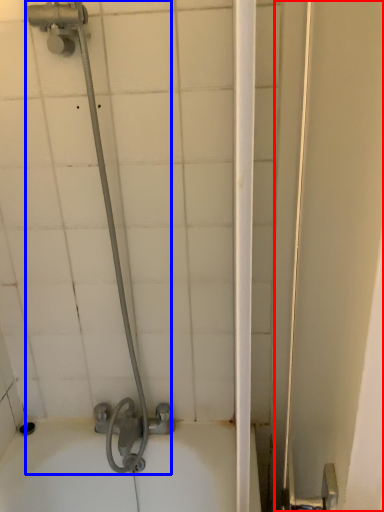
Question: Among these objects, which one is nearest to the camera, screen door (highlighted by a red box) or shower (highlighted by a blue box)?

Choices:
 (A) screen door
 (B) shower

Answer: (A)